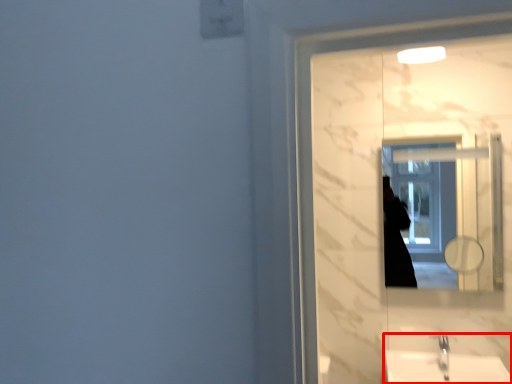
Question: Where is sink (annotated by the red box) located in relation to mirror in the image?

Choices:
 (A) right
 (B) left

Answer: (A)